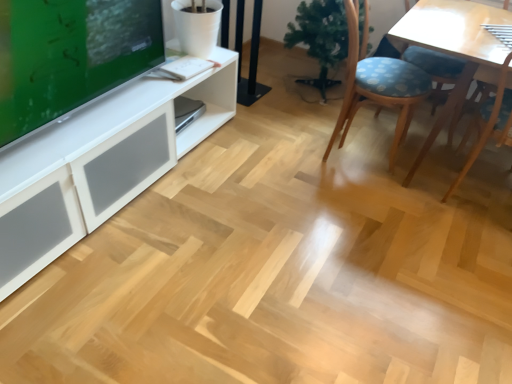
What do you see at coordinates (70, 55) in the screenshot? I see `green glossy tv at upper left` at bounding box center [70, 55].

Identify the location of green matte artificial plant at center. The image size is (512, 384). (320, 36).

In order to face blue fabric chair at center-right, should I rotate leftwards or rightwards?

You should rotate right by 15.854 degrees.

I want to click on green glossy tv at upper left, so click(x=70, y=55).

Could green glossy tv at upper left be considered to be inside blue fabric chair at center-right?

That's incorrect, green glossy tv at upper left is not inside blue fabric chair at center-right.

From the picture: Which of these two, blue fabric chair at center-right or green glossy tv at upper left, is smaller?

Smaller between the two is green glossy tv at upper left.

Is blue fabric chair at center-right taller or shorter than green glossy tv at upper left?

Clearly, blue fabric chair at center-right is taller compared to green glossy tv at upper left.

From a real-world perspective, is blue fabric chair at center-right positioned above or below green glossy tv at upper left?

From a real-world perspective, blue fabric chair at center-right is physically below green glossy tv at upper left.

From a real-world perspective, is green glossy tv at upper left physically above blue fabric chair at center-right?

Yes.

From the image's perspective, is green glossy tv at upper left located above or below blue fabric chair at center-right?

green glossy tv at upper left is situated lower than blue fabric chair at center-right in the image.

Does green glossy tv at upper left have a lesser height compared to blue fabric chair at center-right?

Yes.

Is green glossy tv at upper left beside blue fabric chair at center-right?

No.

Which of these two, blue fabric chair at center-right or green matte artificial plant at center, stands shorter?

green matte artificial plant at center.

Is blue fabric chair at center-right turned away from green matte artificial plant at center?

blue fabric chair at center-right is not turned away from green matte artificial plant at center.

From the image's perspective, which one is positioned lower, blue fabric chair at center-right or green matte artificial plant at center?

blue fabric chair at center-right appears lower in the image.

What are the coordinates of `houseplant on the left side of blue fabric chair at center-right` in the screenshot? It's located at (320, 36).

Considering the relative sizes of green matte artificial plant at center and green glossy tv at upper left in the image provided, is green matte artificial plant at center bigger than green glossy tv at upper left?

Correct, green matte artificial plant at center is larger in size than green glossy tv at upper left.

From a real-world perspective, is green matte artificial plant at center located higher than green glossy tv at upper left?

Incorrect, from a real-world perspective, green matte artificial plant at center is lower than green glossy tv at upper left.

Considering the sizes of objects green matte artificial plant at center and green glossy tv at upper left in the image provided, who is shorter, green matte artificial plant at center or green glossy tv at upper left?

Standing shorter between the two is green glossy tv at upper left.

Is green matte artificial plant at center positioned with its back to green glossy tv at upper left?

No, green matte artificial plant at center's orientation is not away from green glossy tv at upper left.

Between green glossy tv at upper left and green matte artificial plant at center, which one has less height?

green glossy tv at upper left.

Is green glossy tv at upper left not near green matte artificial plant at center?

Yes, green glossy tv at upper left is far from green matte artificial plant at center.

Considering the sizes of objects green glossy tv at upper left and green matte artificial plant at center in the image provided, who is wider, green glossy tv at upper left or green matte artificial plant at center?

green matte artificial plant at center.

From the picture: Which object is closer to the camera, green glossy tv at upper left or green matte artificial plant at center?

green glossy tv at upper left is more forward.

From a real-world perspective, which is physically above, green matte artificial plant at center or blue fabric chair at center-right?

blue fabric chair at center-right, from a real-world perspective.

Is green matte artificial plant at center smaller than blue fabric chair at center-right?

Correct, green matte artificial plant at center occupies less space than blue fabric chair at center-right.

Is green matte artificial plant at center next to blue fabric chair at center-right?

No, green matte artificial plant at center is not making contact with blue fabric chair at center-right.

Which of these two, green matte artificial plant at center or blue fabric chair at center-right, is wider?

blue fabric chair at center-right is wider.

Locate an element on the screen. This screenshot has height=384, width=512. chair on the right of the green glossy tv at upper left is located at coordinates (378, 83).

In order to click on chair above the green glossy tv at upper left (from the image's perspective) in this screenshot , I will do `click(378, 83)`.

From the image, which object appears to be nearer to green matte artificial plant at center, blue fabric chair at center-right or green glossy tv at upper left?

blue fabric chair at center-right.

Looking at the image, which one is located closer to green glossy tv at upper left, blue fabric chair at center-right or green matte artificial plant at center?

Based on the image, blue fabric chair at center-right appears to be nearer to green glossy tv at upper left.

Based on their spatial positions, is green matte artificial plant at center or blue fabric chair at center-right further from green glossy tv at upper left?

green matte artificial plant at center lies further to green glossy tv at upper left than the other object.

Considering their positions, is green matte artificial plant at center positioned closer to blue fabric chair at center-right than green glossy tv at upper left?

green matte artificial plant at center is closer to blue fabric chair at center-right.

Consider the image. Estimate the real-world distances between objects in this image. Which object is further from green matte artificial plant at center, green glossy tv at upper left or blue fabric chair at center-right?

green glossy tv at upper left is positioned further to the anchor green matte artificial plant at center.

Estimate the real-world distances between objects in this image. Which object is further from blue fabric chair at center-right, green glossy tv at upper left or green matte artificial plant at center?

Among the two, green glossy tv at upper left is located further to blue fabric chair at center-right.

This screenshot has height=384, width=512. In order to click on houseplant between green glossy tv at upper left and blue fabric chair at center-right in this screenshot , I will do `click(320, 36)`.